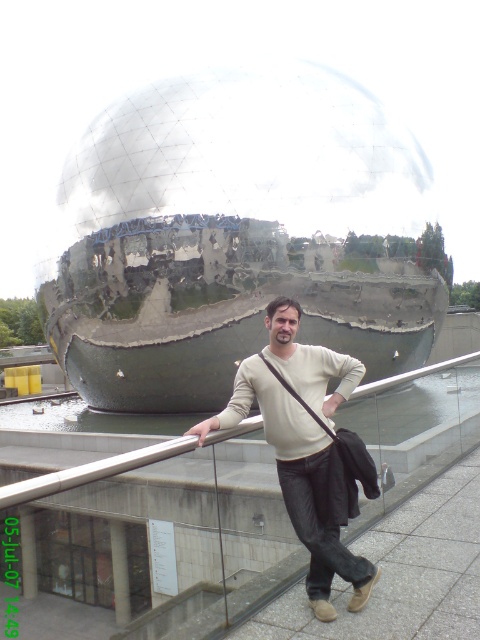
Can you confirm if metallic reflective sphere at center is positioned below metal/smooth rail at center?

No, metallic reflective sphere at center is not below metal/smooth rail at center.

Is metallic reflective sphere at center to the right of metal/smooth rail at center from the viewer's perspective?

Incorrect, metallic reflective sphere at center is not on the right side of metal/smooth rail at center.

Locate an element on the screen. metallic reflective sphere at center is located at coordinates (231, 236).

Is light beige sweater at center behind metal/smooth rail at center?

Yes, it is behind metal/smooth rail at center.

Does light beige sweater at center come in front of metal/smooth rail at center?

No, it is behind metal/smooth rail at center.

Which is behind, point (295, 477) or point (63, 476)?

The point (295, 477) is behind.

The width and height of the screenshot is (480, 640). I want to click on light beige sweater at center, so (302, 445).

Measure the distance between point (316, 284) and camera.

The distance of point (316, 284) from camera is 13.97 meters.

Which is in front, point (169, 186) or point (263, 371)?

Point (263, 371) is in front.

Between point (229, 100) and point (283, 410), which one is positioned behind?

Positioned behind is point (229, 100).

Where is `metallic reflective sphere at center`? This screenshot has height=640, width=480. metallic reflective sphere at center is located at coordinates (231, 236).